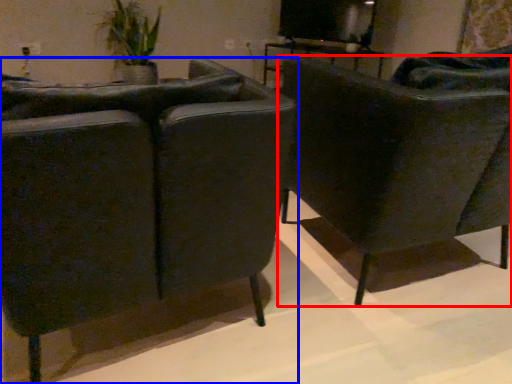
Question: Which object appears closest to the camera in this image, chair (highlighted by a red box) or chair (highlighted by a blue box)?

Choices:
 (A) chair
 (B) chair

Answer: (B)